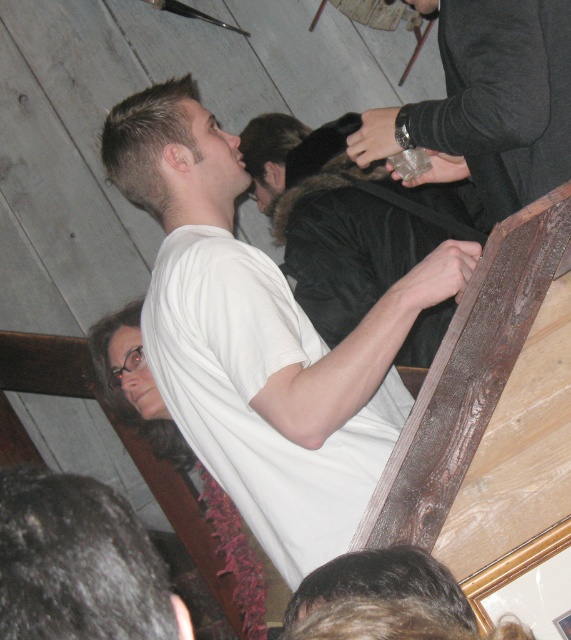
You are standing at the entrance of the bar and want to reach the translucent glass cup at upper right. Which direction should you move to get closer to it?

Since the translucent glass cup at upper right is located at point (492, 100), you should move towards the upper right direction to get closer to it.